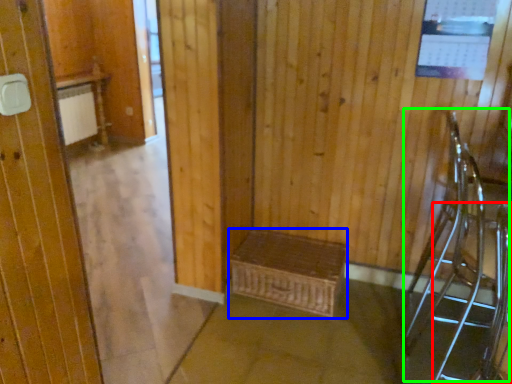
Question: Based on their relative distances, which object is nearer to armchair (highlighted by a red box)? Choose from furniture (highlighted by a blue box) and armchair (highlighted by a green box).

Choices:
 (A) furniture
 (B) armchair

Answer: (B)